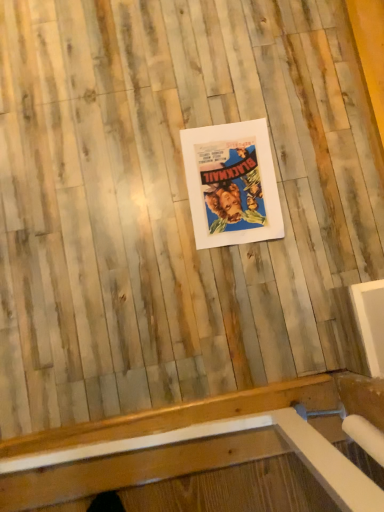
The width and height of the screenshot is (384, 512). Find the location of `vacant area located to the right-hand side of white matte picture frame at center`. vacant area located to the right-hand side of white matte picture frame at center is located at coordinates (323, 195).